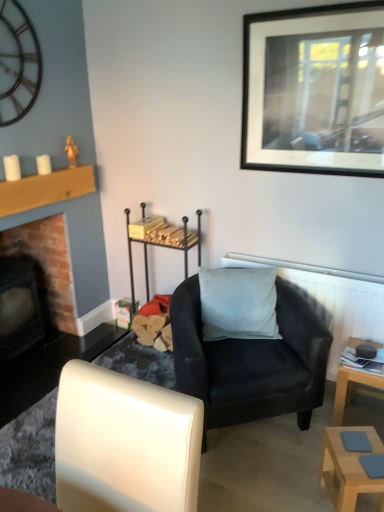
Question: In terms of width, does white leather chair at lower left, the first chair viewed from the front, look wider or thinner when compared to light wood table at lower right, the 2th table when ordered from back to front?

Choices:
 (A) thin
 (B) wide

Answer: (B)

Question: From their relative heights in the image, would you say white leather chair at lower left, the first chair viewed from the front, is taller or shorter than light wood table at lower right, the 2th table when ordered from back to front?

Choices:
 (A) short
 (B) tall

Answer: (B)

Question: Estimate the real-world distances between objects in this image. Which object is closer to the light wood table at lower right, the 2th table when ordered from back to front?

Choices:
 (A) white leather chair at lower left, the first chair viewed from the front
 (B) brick fireplace at left
 (C) matte black armchair at center, the first chair positioned from the back
 (D) white textured radiator at upper right
 (E) light brown wooden table at lower right, which is the first table from back to front

Answer: (E)

Question: Based on their relative distances, which object is farther from the brick fireplace at left?

Choices:
 (A) metallic clock at upper left
 (B) light wood table at lower right, the 2th table when ordered from back to front
 (C) suede-like gray pillow at center
 (D) white textured radiator at upper right
 (E) white leather chair at lower left, the 2th chair when ordered from back to front

Answer: (B)